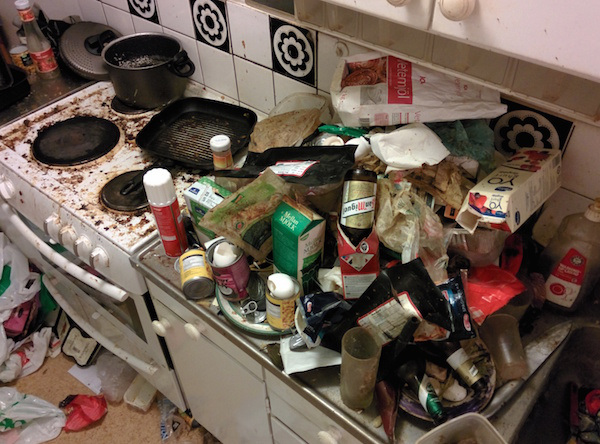
This screenshot has width=600, height=444. Identify the location of oven knobs. (7, 188), (55, 232), (67, 235), (79, 245), (101, 255).